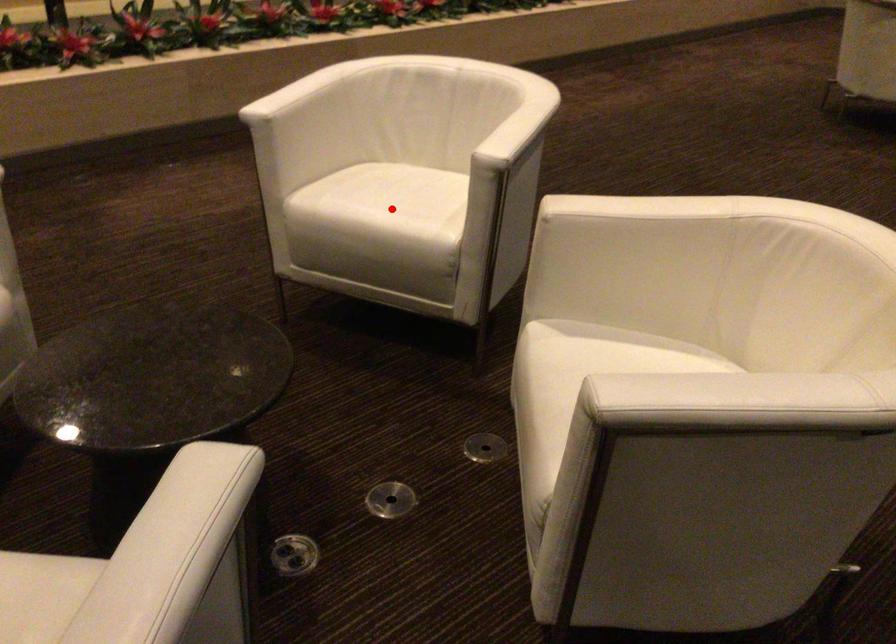
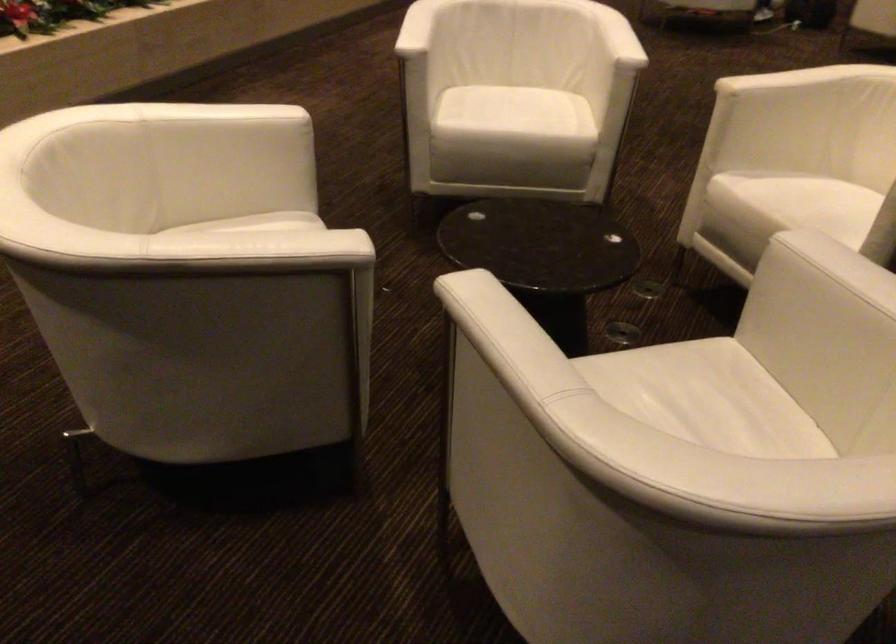
Locate, in the second image, the point that corresponds to the highlighted location in the first image.

(524, 117)